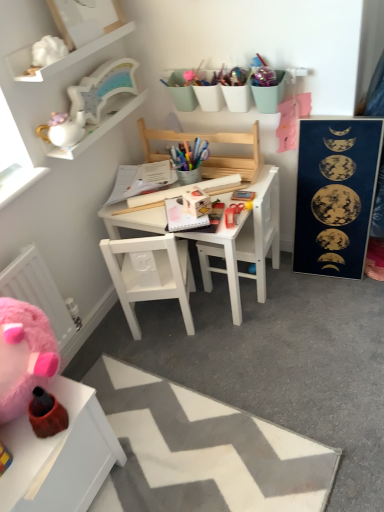
Question: Which is correct: white wooden changing table at center is inside wooden chair at center, acting as the first chair starting from the top, or outside of it?

Choices:
 (A) inside
 (B) outside

Answer: (B)

Question: From a real-world perspective, is white wooden changing table at center positioned above or below wooden chair at center, acting as the first chair starting from the top?

Choices:
 (A) below
 (B) above

Answer: (A)

Question: Which object is the farthest from the white zigzag rug at lower center?

Choices:
 (A) white glossy mug at upper left
 (B) white matte chair at center, acting as the 2th chair starting from the top
 (C) matte white table at lower left, the 2th table when ordered from back to front
 (D) white fluffy cloud at upper left, marked as the 1th toy in a top-to-bottom arrangement
 (E) white wooden table at center, arranged as the second table when ordered from the bottom

Answer: (D)

Question: Which is farther from the blue matte poster at right?

Choices:
 (A) white glossy mug at upper left
 (B) white matte cloud at upper left
 (C) wooden chair at center, acting as the first chair starting from the top
 (D) white ceramic teapot at upper left, the second toy when ordered from top to bottom
 (E) white zigzag rug at lower center

Answer: (B)